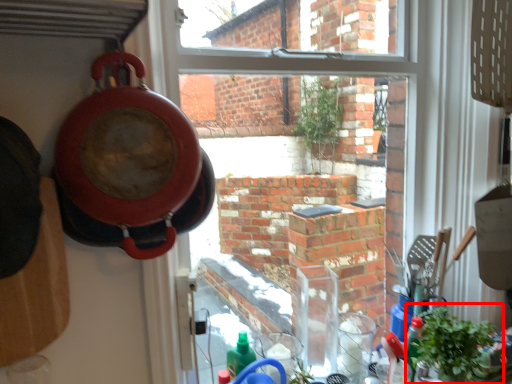
Question: From the image's perspective, considering the relative positions of houseplant (annotated by the red box) and pizza pan in the image provided, where is houseplant (annotated by the red box) located with respect to the staircase?

Choices:
 (A) below
 (B) above

Answer: (A)